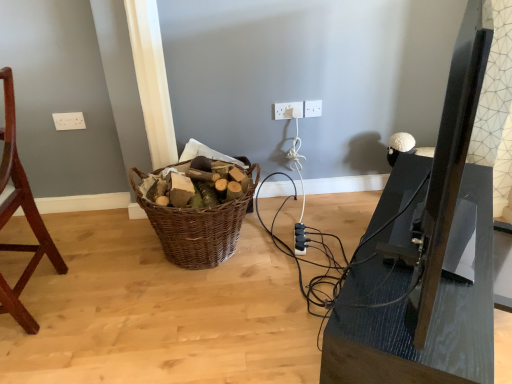
Image resolution: width=512 pixels, height=384 pixels. Find the location of `free space in front of woven brown basket at center`. free space in front of woven brown basket at center is located at coordinates (217, 314).